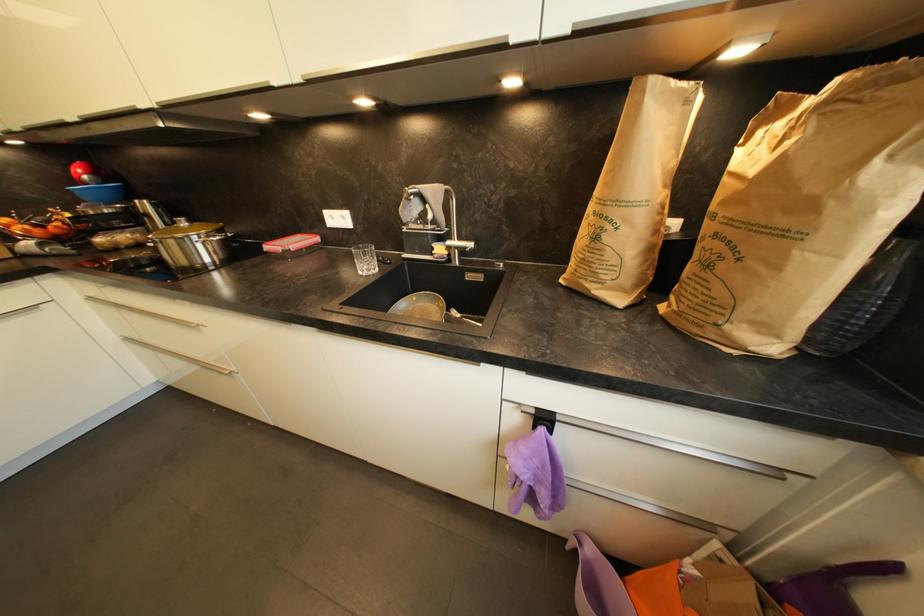
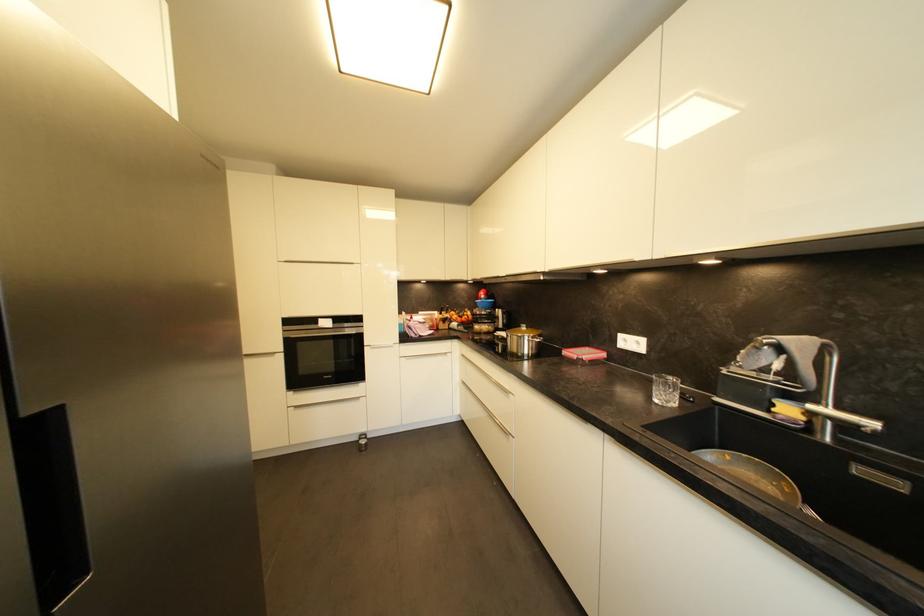
The point at (348,219) is marked in the first image. Where is the corresponding point in the second image?

(642, 345)